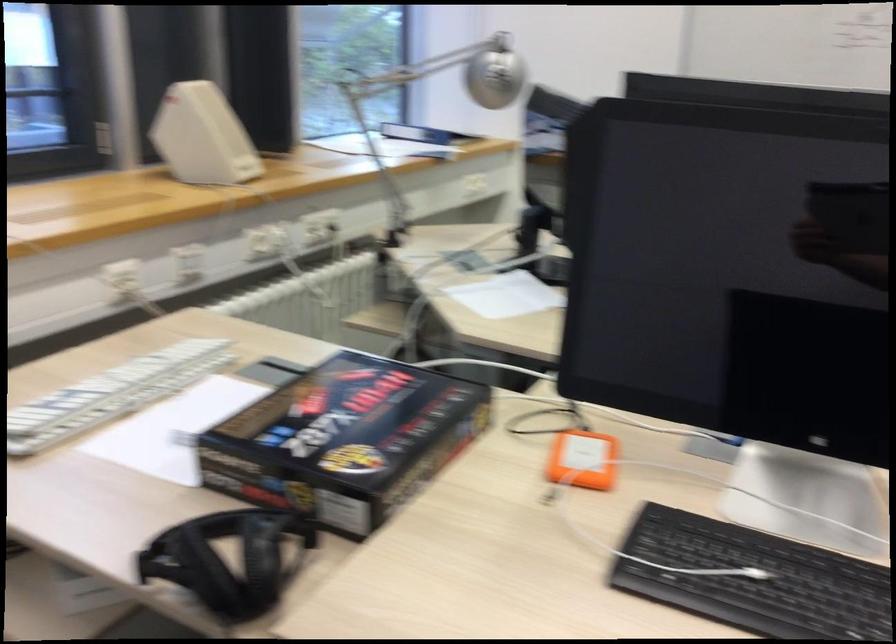
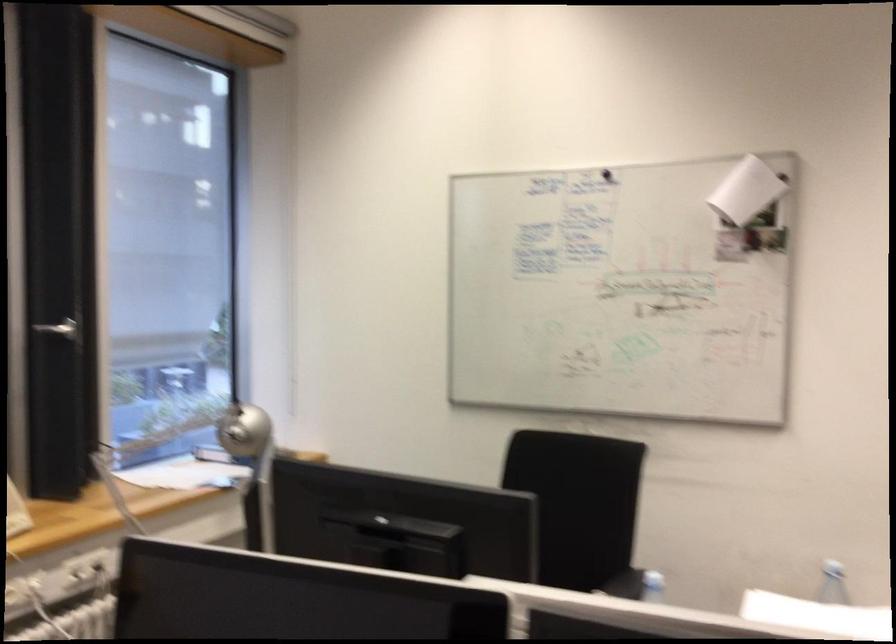
In a continuous first-person perspective shot, in which direction is the camera moving?

The cameraman walked toward right, backward.